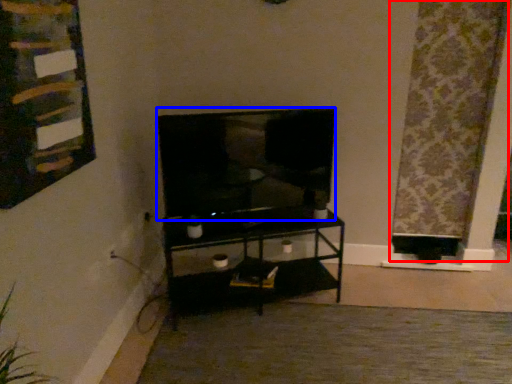
Question: Which object is closer to the camera taking this photo, curtain (highlighted by a red box) or television (highlighted by a blue box)?

Choices:
 (A) curtain
 (B) television

Answer: (B)